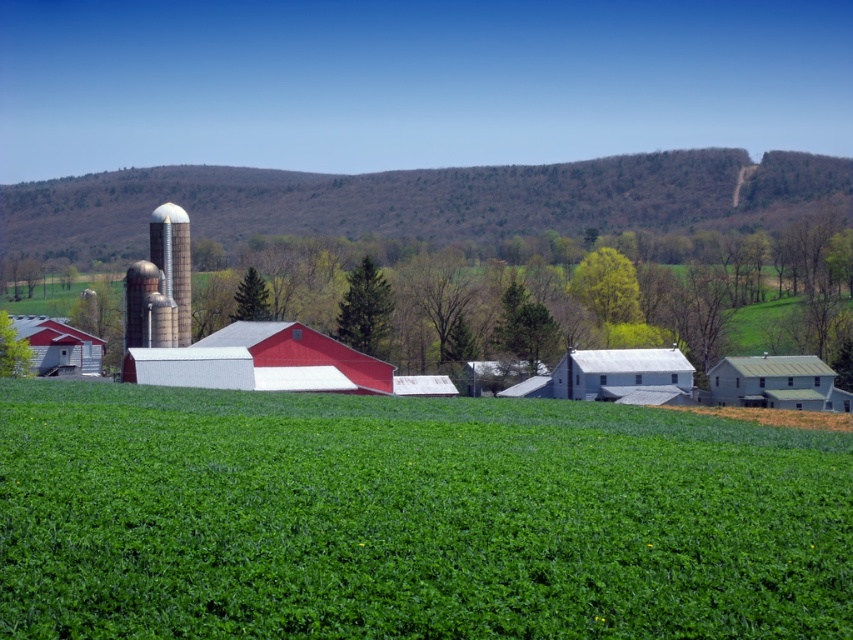
Does point (144, 212) come closer to viewer compared to point (64, 332)?

No, it is not.

Can you confirm if green textured hillside at upper center is bigger than matte red barn at left?

Yes.

Based on the photo, who is more distant from viewer, (190, 182) or (21, 330)?

Positioned behind is point (190, 182).

The width and height of the screenshot is (853, 640). I want to click on green textured hillside at upper center, so click(422, 200).

Who is more distant from viewer, (x=215, y=358) or (x=178, y=260)?

Point (x=178, y=260)

At what (x,y) coordinates should I click in order to perform the action: click on matte white barn at center. Please return your answer as a coordinate pair (x, y). This screenshot has height=640, width=853. Looking at the image, I should click on (260, 362).

Between point (280, 374) and point (177, 211), which one is positioned behind?

The point (177, 211) is behind.

I want to click on matte white barn at center, so click(260, 362).

Does point (618, 184) come closer to viewer compared to point (308, 362)?

No, (618, 184) is further to viewer.

Which is in front, point (51, 205) or point (337, 368)?

Point (337, 368)

Locate an element on the screen. The image size is (853, 640). green textured hillside at upper center is located at coordinates (422, 200).